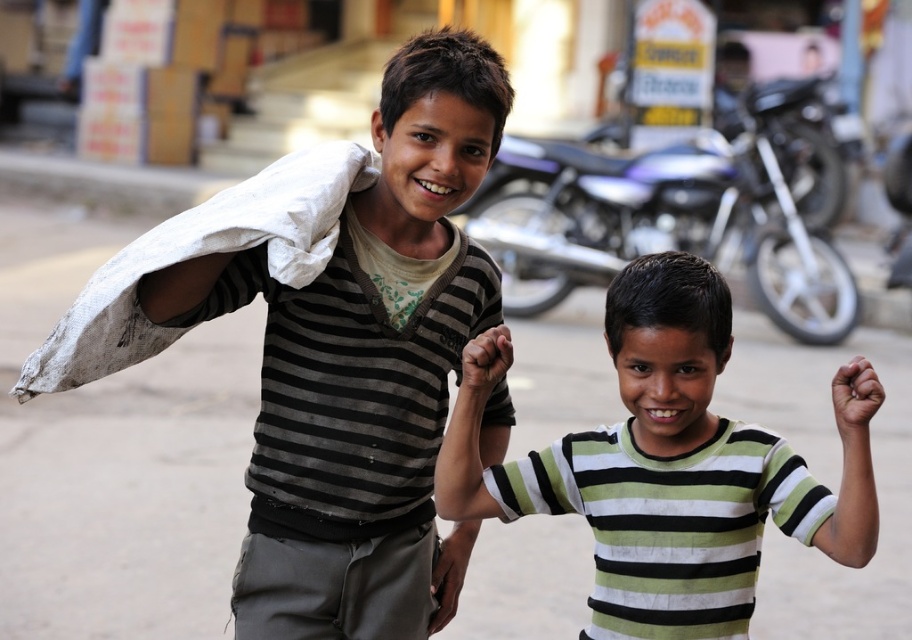
Please describe the exact location of the green striped shirt at center in the image using coordinates.

The green striped shirt at center is located at point coordinates of (668,465).